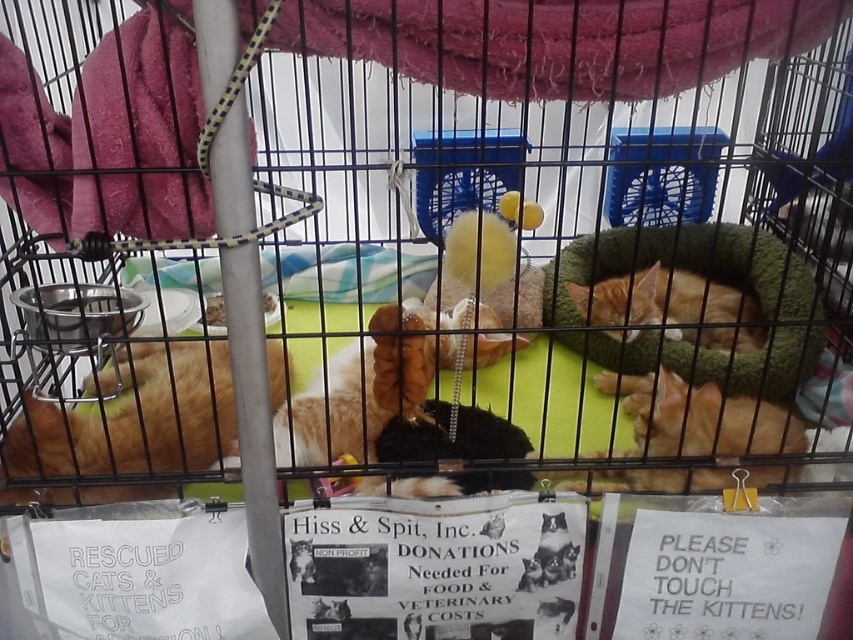
Question: Is orange fur cat at lower right bigger than orange fur cat at center?

Choices:
 (A) yes
 (B) no

Answer: (B)

Question: Which object is closer to the camera taking this photo?

Choices:
 (A) blue plastic bird cage at upper center
 (B) yellow plush toy at center

Answer: (B)

Question: Can you confirm if blue plastic bird cage at upper center is positioned to the right of orange fur cat at center?

Choices:
 (A) no
 (B) yes

Answer: (B)

Question: Which object appears closest to the camera in this image?

Choices:
 (A) orange fur cat at lower right
 (B) fluffy orange cat at center
 (C) yellow plush toy at center

Answer: (C)

Question: Is orange fur cat at lower right smaller than yellow plush toy at center?

Choices:
 (A) yes
 (B) no

Answer: (A)

Question: Which of the following is the farthest from the observer?

Choices:
 (A) (676, 296)
 (B) (698, 180)
 (C) (758, 445)
 (D) (283, 448)

Answer: (B)